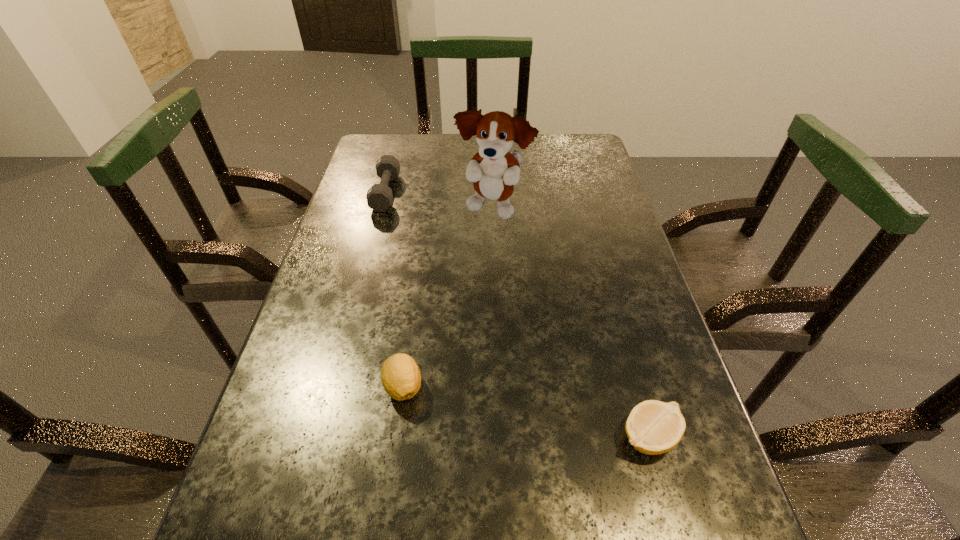
Where is `puppy`? puppy is located at coordinates (494, 171).

In order to click on the tallest object in this screenshot , I will do `click(494, 171)`.

Where is `the farther lemon`? The width and height of the screenshot is (960, 540). the farther lemon is located at coordinates [401, 379].

Locate an element on the screen. This screenshot has width=960, height=540. the second nearest object is located at coordinates (401, 379).

The image size is (960, 540). In order to click on the leftmost object in this screenshot , I will do `click(379, 197)`.

At what (x,y) coordinates should I click in order to perform the action: click on the shortest object. Please return your answer as a coordinate pair (x, y). The height and width of the screenshot is (540, 960). Looking at the image, I should click on (653, 427).

The height and width of the screenshot is (540, 960). In order to click on the nearest object in this screenshot , I will do `click(653, 427)`.

The width and height of the screenshot is (960, 540). Identify the location of vacant region located 0.050m on the face of the tallest object. (494, 244).

This screenshot has height=540, width=960. Find the location of `vacant space positioned at the stem end of the taller lemon`. vacant space positioned at the stem end of the taller lemon is located at coordinates (383, 529).

Locate an element on the screen. This screenshot has height=540, width=960. vacant region located 0.340m on the right of the leftmost object is located at coordinates (516, 192).